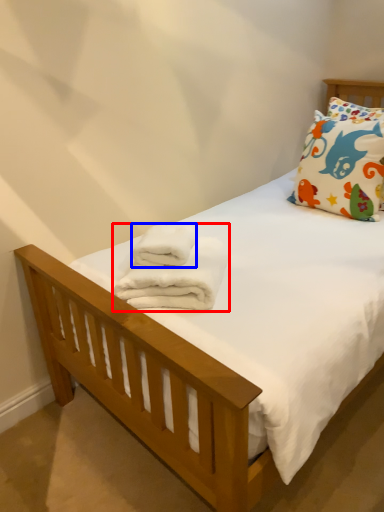
Question: Which object appears closest to the camera in this image, bath towel (highlighted by a red box) or bath towel (highlighted by a blue box)?

Choices:
 (A) bath towel
 (B) bath towel

Answer: (A)